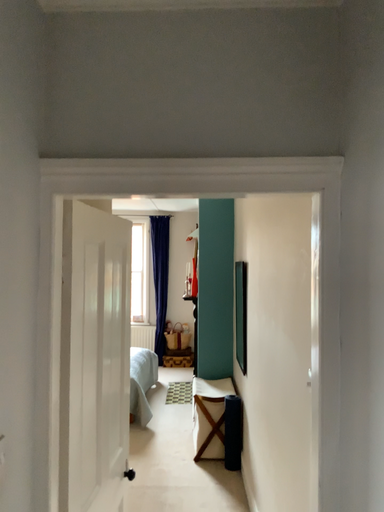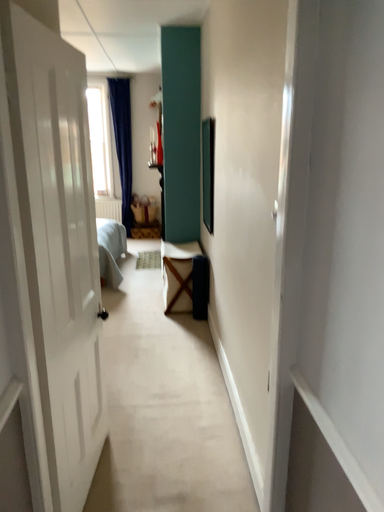
Question: How did the camera likely rotate when shooting the video?

Choices:
 (A) rotated downward
 (B) rotated upward

Answer: (A)